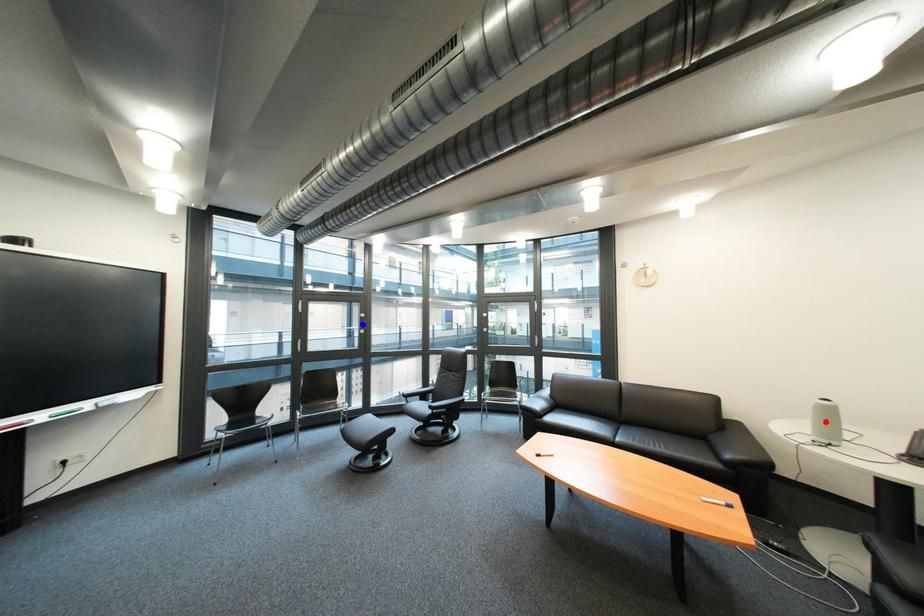
Question: In the image, two points are highlighted. Which point is nearer to the camera? Reply with the corresponding letter.

Choices:
 (A) blue point
 (B) red point

Answer: (B)